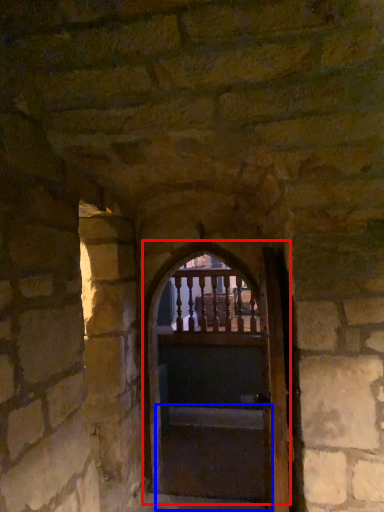
Question: Which object is closer to the camera taking this photo, door (highlighted by a red box) or stairs (highlighted by a blue box)?

Choices:
 (A) door
 (B) stairs

Answer: (A)